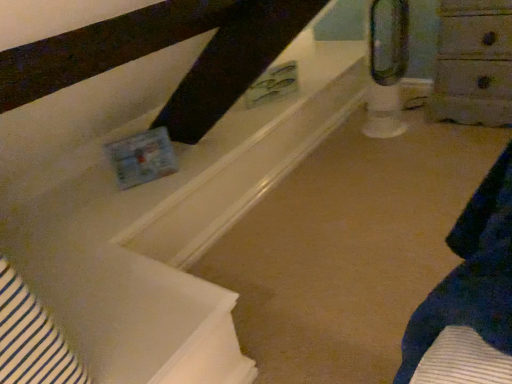
Image resolution: width=512 pixels, height=384 pixels. What are the coordinates of `free space that is to the left of white wood chest of drawers at upper right` in the screenshot? It's located at tap(415, 134).